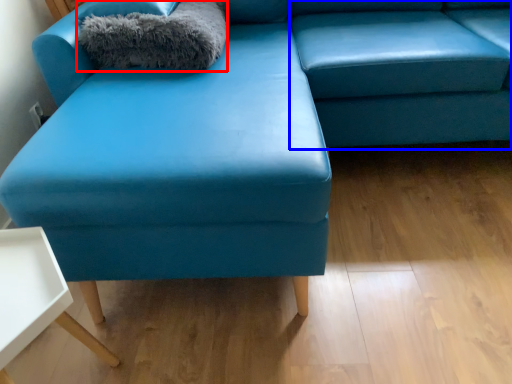
Question: Which of the following is the farthest to the observer, blanket (highlighted by a red box) or swivel chair (highlighted by a blue box)?

Choices:
 (A) blanket
 (B) swivel chair

Answer: (A)